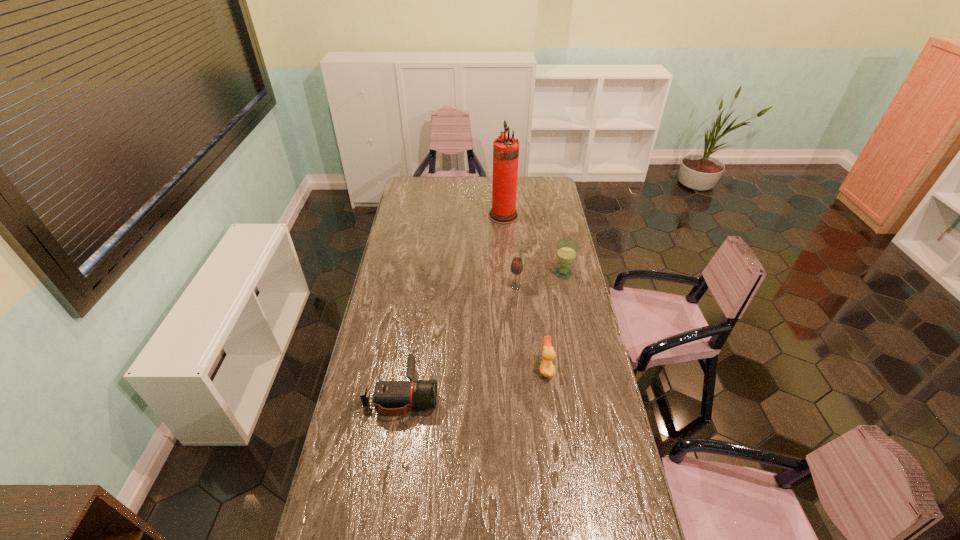
Image resolution: width=960 pixels, height=540 pixels. Find the location of `the farthest object`. the farthest object is located at coordinates (505, 148).

I want to click on fire extinguisher, so click(x=505, y=148).

Identify the location of the farther glass drink container. This screenshot has width=960, height=540. (567, 249).

This screenshot has width=960, height=540. I want to click on the right glass drink container, so [x=567, y=249].

Locate an element on the screen. the third nearest object is located at coordinates (517, 265).

Where is `the nearer glass drink container`? Image resolution: width=960 pixels, height=540 pixels. the nearer glass drink container is located at coordinates (517, 265).

Find the location of `duck`. duck is located at coordinates (547, 369).

Where is `the leftmost object`? the leftmost object is located at coordinates (392, 398).

The width and height of the screenshot is (960, 540). I want to click on vacant space located at the discharge end of the fire extinguisher, so click(x=467, y=215).

In order to click on vacant area located at the discharge end of the fire extinguisher in this screenshot , I will do `click(426, 215)`.